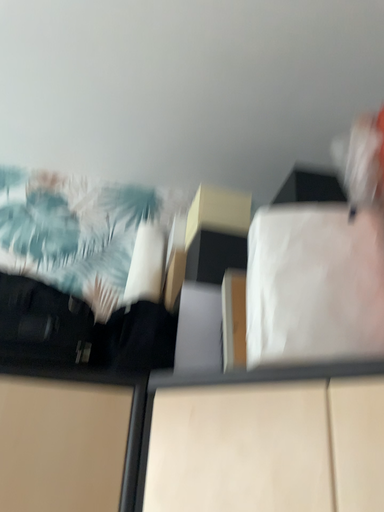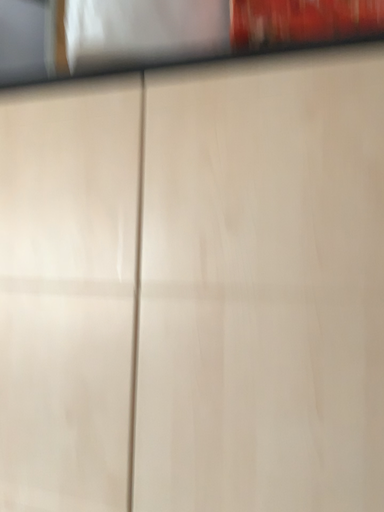
Question: How did the camera likely rotate when shooting the video?

Choices:
 (A) rotated downward
 (B) rotated upward

Answer: (A)